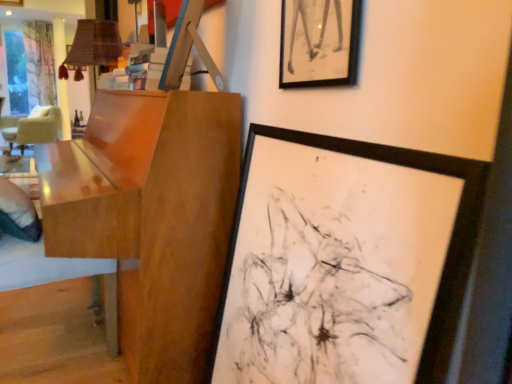
Question: Considering the relative positions of black matte picture frame at center, the 2th picture frame viewed from the top, and glossy wood table at left in the image provided, is black matte picture frame at center, the 2th picture frame viewed from the top, to the left of glossy wood table at left from the viewer's perspective?

Choices:
 (A) no
 (B) yes

Answer: (A)

Question: Considering the relative sizes of black matte picture frame at center, marked as the 1th picture frame in a bottom-to-top arrangement, and glossy wood table at left in the image provided, is black matte picture frame at center, marked as the 1th picture frame in a bottom-to-top arrangement, wider than glossy wood table at left?

Choices:
 (A) no
 (B) yes

Answer: (A)

Question: From a real-world perspective, does black matte picture frame at center, the 2th picture frame viewed from the top, sit lower than glossy wood table at left?

Choices:
 (A) no
 (B) yes

Answer: (B)

Question: Is black matte picture frame at center, marked as the 1th picture frame in a bottom-to-top arrangement, touching glossy wood table at left?

Choices:
 (A) no
 (B) yes

Answer: (A)

Question: Considering the relative sizes of black matte picture frame at center, marked as the 1th picture frame in a bottom-to-top arrangement, and glossy wood table at left in the image provided, is black matte picture frame at center, marked as the 1th picture frame in a bottom-to-top arrangement, shorter than glossy wood table at left?

Choices:
 (A) no
 (B) yes

Answer: (B)

Question: From a real-world perspective, is black matte picture frame at center, the 2th picture frame viewed from the top, positioned above or below beige fabric chair at left?

Choices:
 (A) above
 (B) below

Answer: (A)

Question: Considering the relative positions of black matte picture frame at center, the 2th picture frame viewed from the top, and beige fabric chair at left in the image provided, is black matte picture frame at center, the 2th picture frame viewed from the top, to the left or to the right of beige fabric chair at left?

Choices:
 (A) left
 (B) right

Answer: (B)

Question: Choose the correct answer: Is black matte picture frame at center, marked as the 1th picture frame in a bottom-to-top arrangement, inside beige fabric chair at left or outside it?

Choices:
 (A) outside
 (B) inside

Answer: (A)

Question: Looking at their shapes, would you say black matte picture frame at center, marked as the 1th picture frame in a bottom-to-top arrangement, is wider or thinner than beige fabric chair at left?

Choices:
 (A) thin
 (B) wide

Answer: (A)

Question: Looking at the image, does beige fabric chair at left seem bigger or smaller compared to black matte picture frame at upper center, the 2th picture frame when ordered from bottom to top?

Choices:
 (A) big
 (B) small

Answer: (A)

Question: Which is correct: beige fabric chair at left is inside black matte picture frame at upper center, the 1th picture frame positioned from the top, or outside of it?

Choices:
 (A) outside
 (B) inside

Answer: (A)

Question: Considering the relative positions of beige fabric chair at left and black matte picture frame at upper center, the 1th picture frame positioned from the top, in the image provided, is beige fabric chair at left to the left or to the right of black matte picture frame at upper center, the 1th picture frame positioned from the top,?

Choices:
 (A) right
 (B) left

Answer: (B)

Question: From the image's perspective, relative to black matte picture frame at upper center, the 1th picture frame positioned from the top, is beige fabric chair at left above or below?

Choices:
 (A) above
 (B) below

Answer: (A)

Question: From the image's perspective, is glossy wood table at left located above or below black matte picture frame at center, marked as the 1th picture frame in a bottom-to-top arrangement?

Choices:
 (A) below
 (B) above

Answer: (B)

Question: From a real-world perspective, relative to black matte picture frame at center, the 2th picture frame viewed from the top, is glossy wood table at left vertically above or below?

Choices:
 (A) above
 (B) below

Answer: (A)